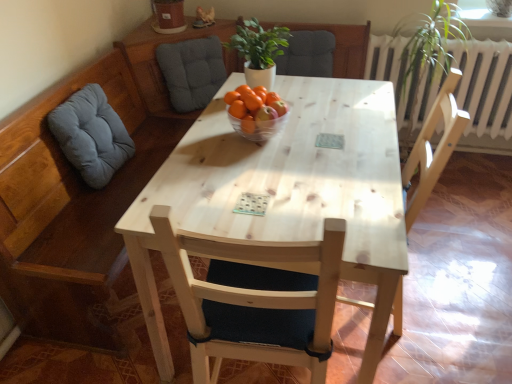
Question: Is transparent glass bowl at center at the right side of light wood chair at center, positioned as the 1th chair in left-to-right order?

Choices:
 (A) no
 (B) yes

Answer: (A)

Question: Would you say transparent glass bowl at center is outside light wood chair at center, the second chair viewed from the right?

Choices:
 (A) yes
 (B) no

Answer: (A)

Question: Does transparent glass bowl at center turn towards light wood chair at center, the second chair viewed from the right?

Choices:
 (A) no
 (B) yes

Answer: (A)

Question: Is transparent glass bowl at center taller than light wood chair at center, the second chair viewed from the right?

Choices:
 (A) yes
 (B) no

Answer: (B)

Question: Can you confirm if transparent glass bowl at center is bigger than light wood chair at center, the second chair viewed from the right?

Choices:
 (A) no
 (B) yes

Answer: (A)

Question: Visually, is light wood chair at center, the second chair viewed from the right, positioned to the left or to the right of matte gray cushioned armchair at upper center?

Choices:
 (A) left
 (B) right

Answer: (A)

Question: Is point (312, 304) positioned closer to the camera than point (308, 71)?

Choices:
 (A) closer
 (B) farther

Answer: (A)

Question: From a real-world perspective, is light wood chair at center, the second chair viewed from the right, positioned above or below matte gray cushioned armchair at upper center?

Choices:
 (A) above
 (B) below

Answer: (B)

Question: Which is correct: light wood chair at center, the second chair viewed from the right, is inside matte gray cushioned armchair at upper center, or outside of it?

Choices:
 (A) outside
 (B) inside

Answer: (A)

Question: Based on their sizes in the image, would you say light wood chair at center, the second chair viewed from the right, is bigger or smaller than gray fabric cushion at left, the second swivel chair positioned from the right?

Choices:
 (A) big
 (B) small

Answer: (A)

Question: Considering the positions of light wood chair at center, the second chair viewed from the right, and gray fabric cushion at left, the second swivel chair positioned from the right, in the image, is light wood chair at center, the second chair viewed from the right, wider or thinner than gray fabric cushion at left, the second swivel chair positioned from the right,?

Choices:
 (A) thin
 (B) wide

Answer: (B)

Question: Is light wood chair at center, positioned as the 1th chair in left-to-right order, taller or shorter than gray fabric cushion at left, positioned as the first swivel chair in front-to-back order?

Choices:
 (A) short
 (B) tall

Answer: (B)

Question: From the image's perspective, is light wood chair at center, positioned as the 1th chair in left-to-right order, above or below gray fabric cushion at left, the second swivel chair positioned from the right?

Choices:
 (A) above
 (B) below

Answer: (B)

Question: Does point (322, 104) appear closer or farther from the camera than point (198, 61)?

Choices:
 (A) closer
 (B) farther

Answer: (A)

Question: From the image's perspective, is light wood chair at right, the 2th chair positioned from the left, located above or below gray fabric cushion at upper left, positioned as the 1th swivel chair in back-to-front order?

Choices:
 (A) above
 (B) below

Answer: (B)